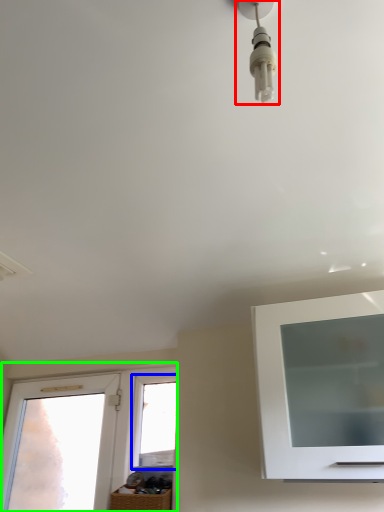
Question: Which is nearer to the light fixture (highlighted by a red box)? window (highlighted by a blue box) or window (highlighted by a green box).

Choices:
 (A) window
 (B) window

Answer: (A)